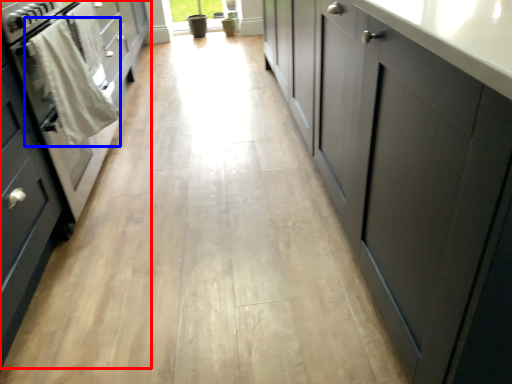
Question: Among these objects, which one is farthest to the camera, cabinetry (highlighted by a red box) or laundry (highlighted by a blue box)?

Choices:
 (A) cabinetry
 (B) laundry

Answer: (B)